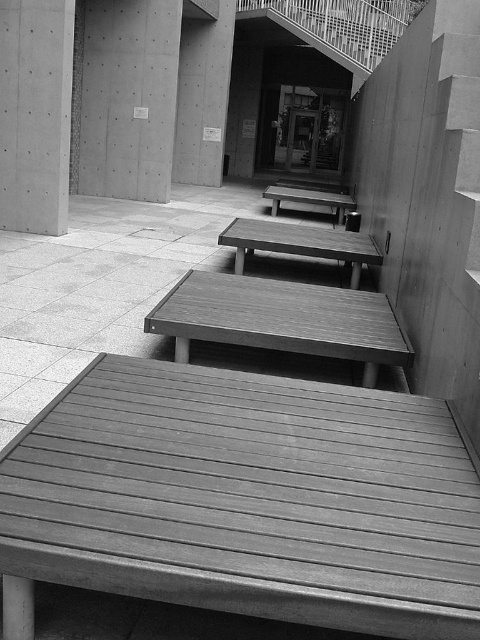
Can you confirm if wooden table at center is wider than wooden bench at center?

No.

Can you confirm if wooden table at center is thinner than wooden bench at center?

Yes.

The width and height of the screenshot is (480, 640). In order to click on wooden table at center in this screenshot , I will do `click(282, 320)`.

Is point (371, 301) closer to viewer compared to point (44, 54)?

That is True.

Who is higher up, wooden table at center or smooth concrete pillar at upper left?

Positioned higher is smooth concrete pillar at upper left.

This screenshot has height=640, width=480. Find the location of `wooden table at center`. wooden table at center is located at coordinates (282, 320).

Locate an element on the screen. This screenshot has height=640, width=480. wooden table at center is located at coordinates (282, 320).

Is wooden table at lower center above wooden park bench at center?

Actually, wooden table at lower center is below wooden park bench at center.

Can you confirm if wooden table at lower center is thinner than wooden park bench at center?

Yes.

I want to click on wooden table at lower center, so click(x=244, y=500).